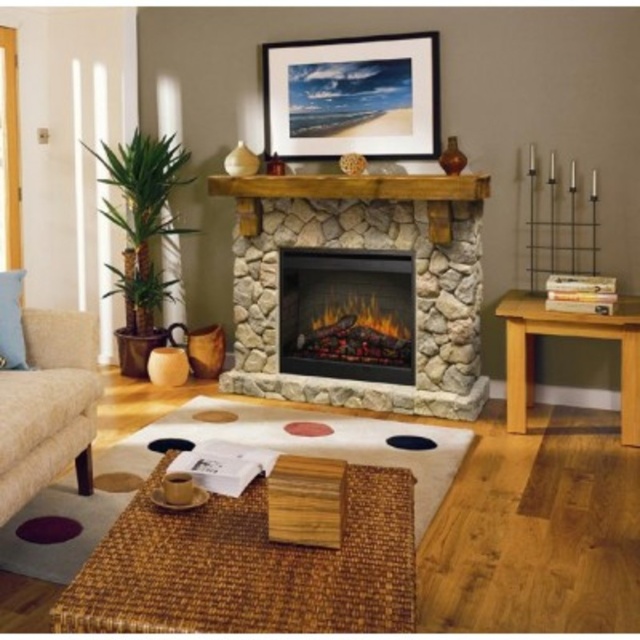
Which is behind, point (182, 627) or point (314, 321)?

The point (314, 321) is behind.

Between woven wood coffee table at center and matte stone fireplace at center, which one appears on the right side from the viewer's perspective?

Positioned to the right is matte stone fireplace at center.

Is point (305, 564) in front of point (326, 371)?

Yes, it is in front of point (326, 371).

You are a GUI agent. You are given a task and a screenshot of the screen. Output one action in this format:
    pyautogui.click(x=<x>, y=<y>)
    Task: Click on the woven wood coffee table at center
    This screenshot has width=640, height=640.
    Given the screenshot: What is the action you would take?
    pyautogui.click(x=250, y=566)

Is point (243, 586) more distant than point (305, 232)?

No, it is not.

Does woven wood coffee table at center lie behind natural stone fireplace at center?

That is False.

Where is `woven wood coffee table at center`? woven wood coffee table at center is located at coordinates pos(250,566).

I want to click on woven wood coffee table at center, so click(250, 566).

Who is lower down, matte black picture frame at upper center or beige fabric couch at lower left?

beige fabric couch at lower left

Is matte black picture frame at upper center thinner than beige fabric couch at lower left?

In fact, matte black picture frame at upper center might be wider than beige fabric couch at lower left.

Is point (397, 68) positioned in front of point (3, 365)?

No.

Where is `matte black picture frame at upper center`? The width and height of the screenshot is (640, 640). matte black picture frame at upper center is located at coordinates (353, 97).